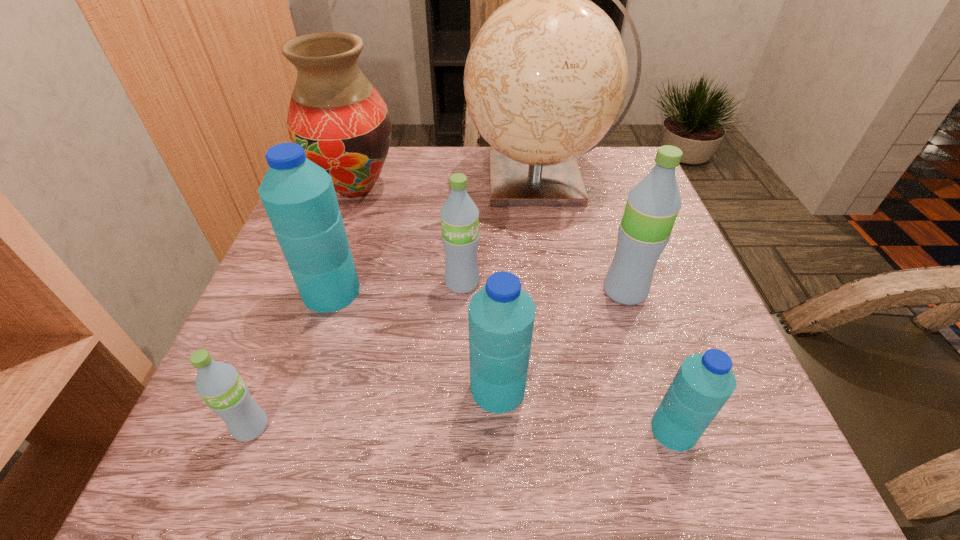
You are a GUI agent. You are given a task and a screenshot of the screen. Output one action in this format:
    pyautogui.click(x=<x>, y=<y>)
    Task: Click on the blank space at the left edge
    This screenshot has height=540, width=960.
    Given the screenshot: What is the action you would take?
    314,380

You are a GUI agent. You are given a task and a screenshot of the screen. Output one action in this format:
    pyautogui.click(x=<x>, y=<y>)
    Task: Click on the vacant space at the right edge
    This screenshot has height=540, width=960.
    Given the screenshot: What is the action you would take?
    pyautogui.click(x=737, y=404)

Identify the location of vacant position at the near left corner of the desktop. The height and width of the screenshot is (540, 960). (215, 466).

In the image, there is a desktop. Find the location of `vacant space at the near right corner`. vacant space at the near right corner is located at coordinates (713, 437).

Where is `vacant area that lies between the vase and the second biggest blue water bottle`? The width and height of the screenshot is (960, 540). vacant area that lies between the vase and the second biggest blue water bottle is located at coordinates (427, 288).

Where is `vacant space that's between the vase and the second green water bottle from left to right`? This screenshot has height=540, width=960. vacant space that's between the vase and the second green water bottle from left to right is located at coordinates (409, 236).

The image size is (960, 540). Find the location of `free space between the rightmost blue water bottle and the second smallest blue water bottle`. free space between the rightmost blue water bottle and the second smallest blue water bottle is located at coordinates (586, 409).

Locate an element on the screen. The height and width of the screenshot is (540, 960). free space that is in between the rightmost blue water bottle and the second blue water bottle from left to right is located at coordinates (586, 409).

You are a GUI agent. You are given a task and a screenshot of the screen. Output one action in this format:
    pyautogui.click(x=<x>, y=<y>)
    Task: Click on the free area in between the second biggest green water bottle and the globe
    The width and height of the screenshot is (960, 540).
    Given the screenshot: What is the action you would take?
    pyautogui.click(x=501, y=232)

The width and height of the screenshot is (960, 540). I want to click on free spot between the second biggest blue water bottle and the vase, so click(427, 288).